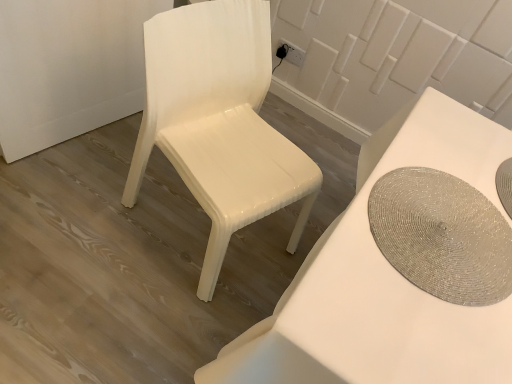
The width and height of the screenshot is (512, 384). I want to click on free spot below shiny silver placemat at right (from a real-world perspective), so (439, 229).